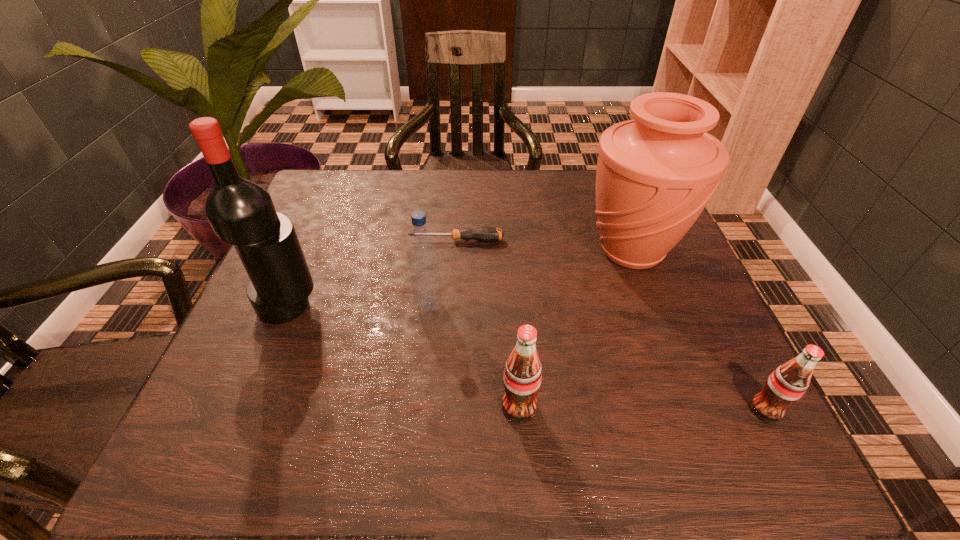
Considering the uniform spacing of sodas, where should an additional soda be positioned on the left? Please locate a free spot. Please provide its 2D coordinates. Your answer should be formatted as a tuple, i.e. [(x, y)], where the tuple contains the x and y coordinates of a point satisfying the conditions above.

[(276, 404)]